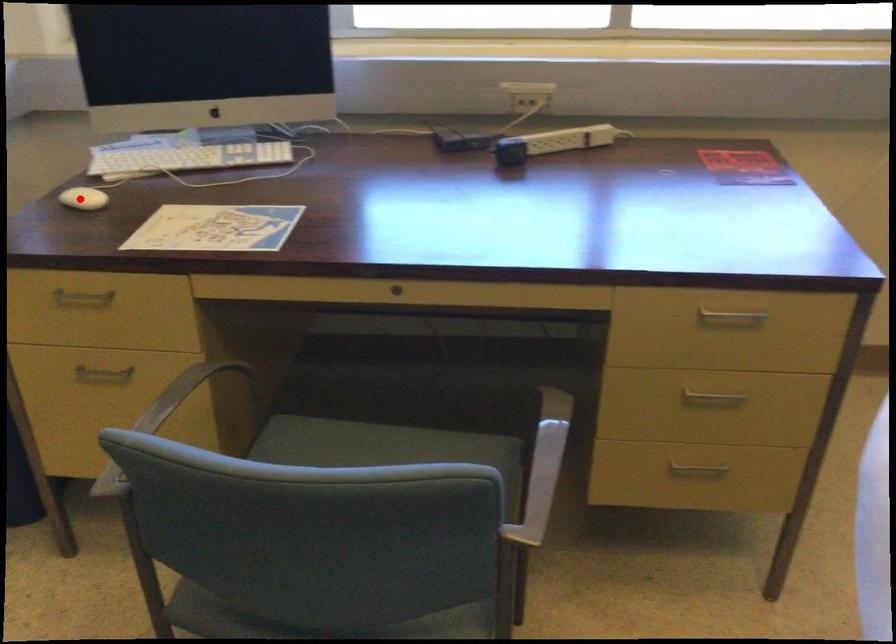
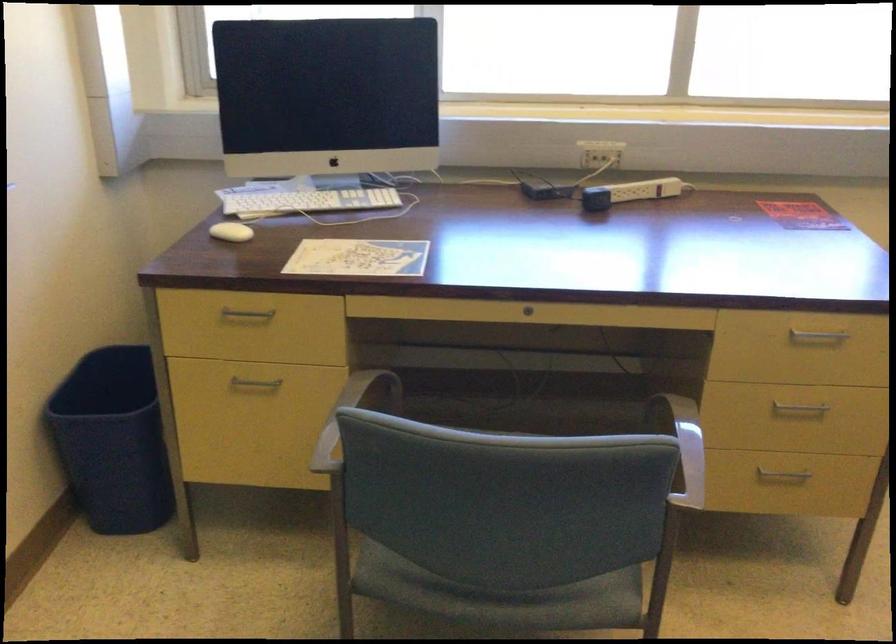
Question: A red point is marked in image1. In image2, is the corresponding 3D point closer to the camera or farther? Reply with the corresponding letter.

Choices:
 (A) The corresponding 3D point is closer.
 (B) The corresponding 3D point is farther.

Answer: (B)